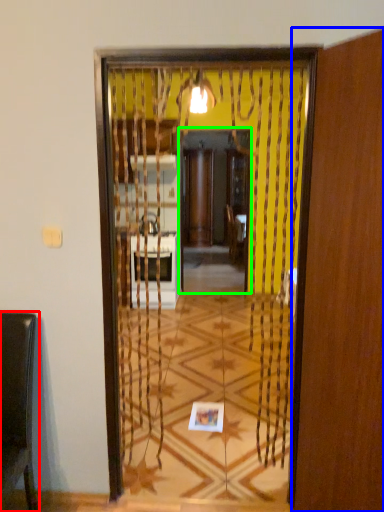
Question: Based on their relative distances, which object is nearer to furniture (highlighted by a red box)? Choose from screen door (highlighted by a blue box) and screen door (highlighted by a green box).

Choices:
 (A) screen door
 (B) screen door

Answer: (A)